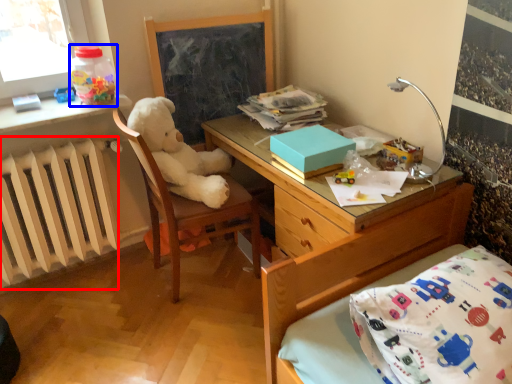
Question: Which point is closer to the camera, radiator (highlighted by a red box) or bottle (highlighted by a blue box)?

Choices:
 (A) radiator
 (B) bottle

Answer: (A)